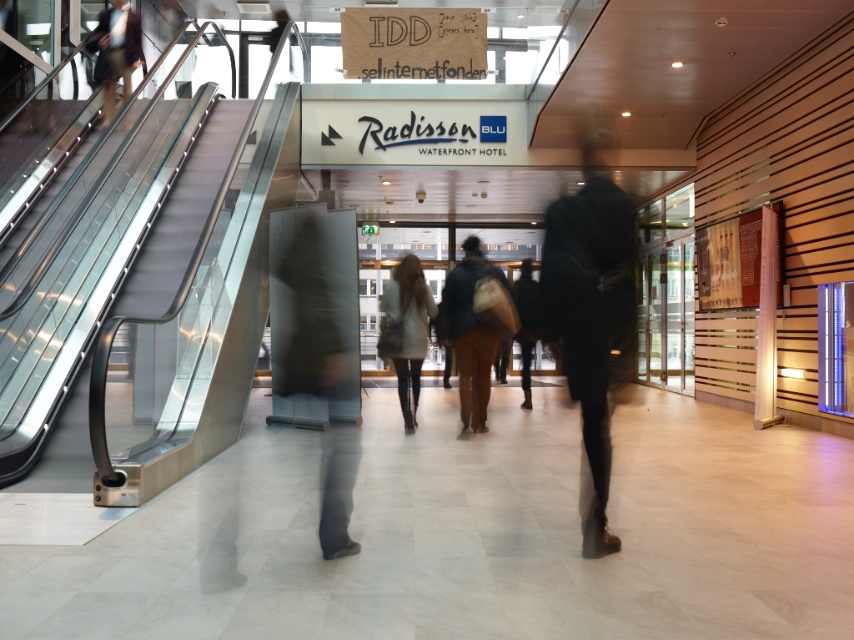
You are a GUI agent. You are given a task and a screenshot of the screen. Output one action in this format:
    pyautogui.click(x=<x>, y=<y>)
    Task: Click on the metallic gray escalator at left
    Image resolution: width=854 pixels, height=640 pixels.
    Given the screenshot: What is the action you would take?
    pyautogui.click(x=180, y=216)

What do you see at coordinates (180, 216) in the screenshot? I see `metallic gray escalator at left` at bounding box center [180, 216].

Identify the location of metallic gray escalator at left. (180, 216).

Which is more to the right, brown leather jacket at center or dark blue jacket at upper left?

brown leather jacket at center is more to the right.

Which of these two, brown leather jacket at center or dark blue jacket at upper left, stands taller?

dark blue jacket at upper left is taller.

Is point (466, 323) less distant than point (106, 88)?

Yes, it is.

Locate an element on the screen. brown leather jacket at center is located at coordinates (469, 332).

Which is in front, point (581, 552) or point (524, 404)?

Point (581, 552) is in front.

What do you see at coordinates (589, 312) in the screenshot? I see `dark gray fabric coat at center` at bounding box center [589, 312].

What are the coordinates of `dark gray fabric coat at center` in the screenshot? It's located at (589, 312).